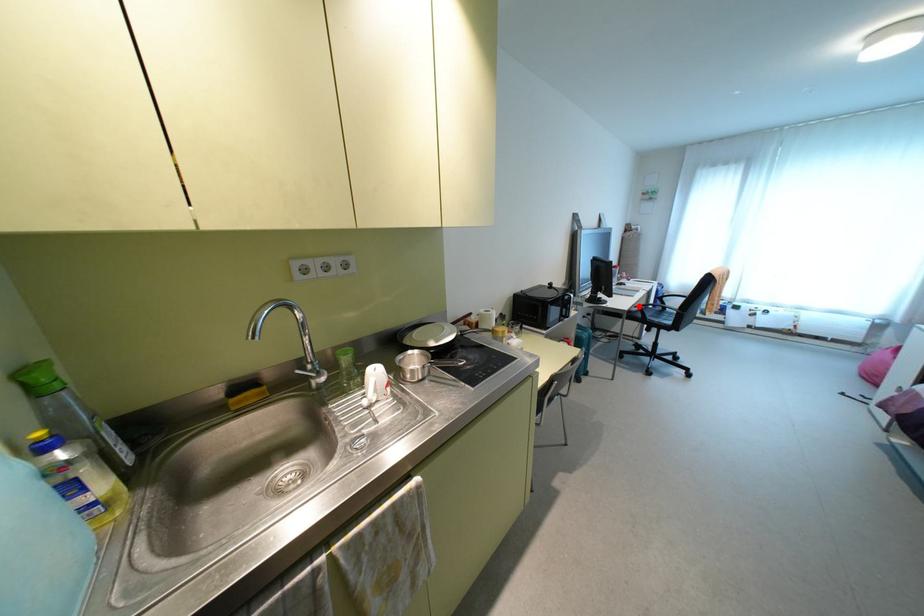
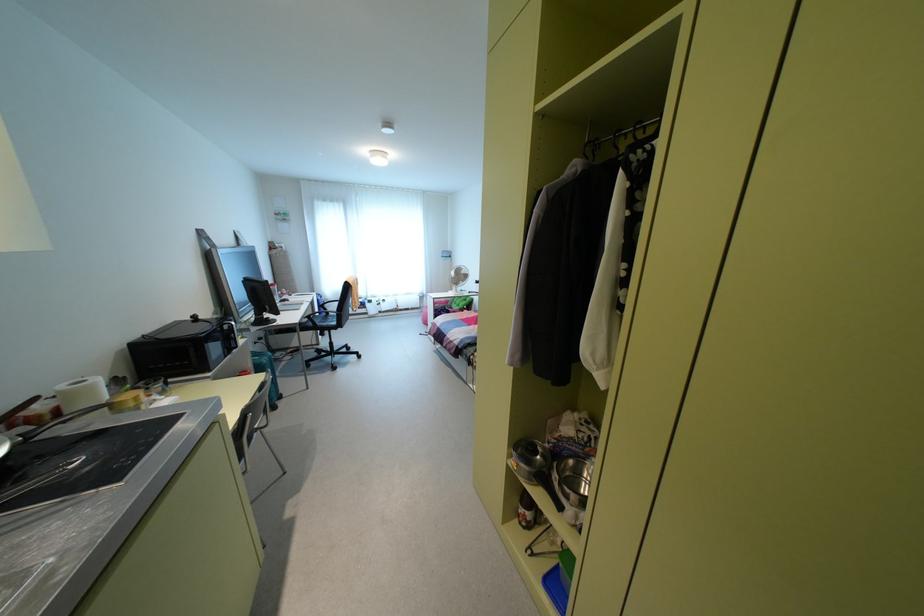
In the second image, find the point that corresponds to the highlighted location in the first image.

(309, 315)